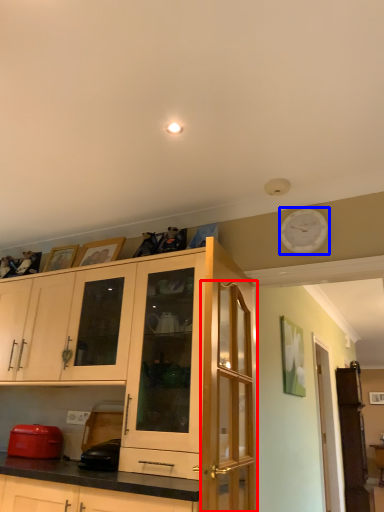
Question: Which point is closer to the camera, glass door (highlighted by a red box) or clock (highlighted by a blue box)?

Choices:
 (A) glass door
 (B) clock

Answer: (A)